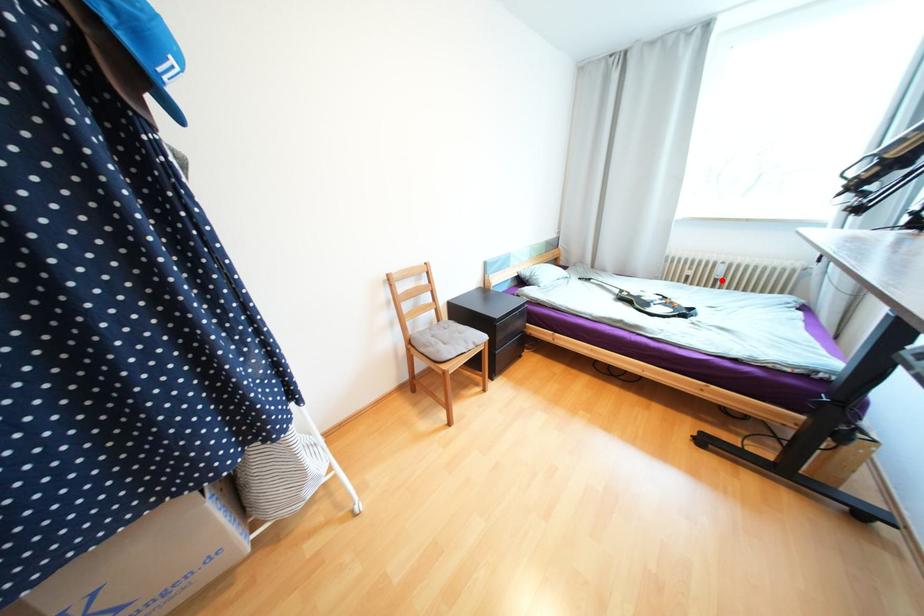
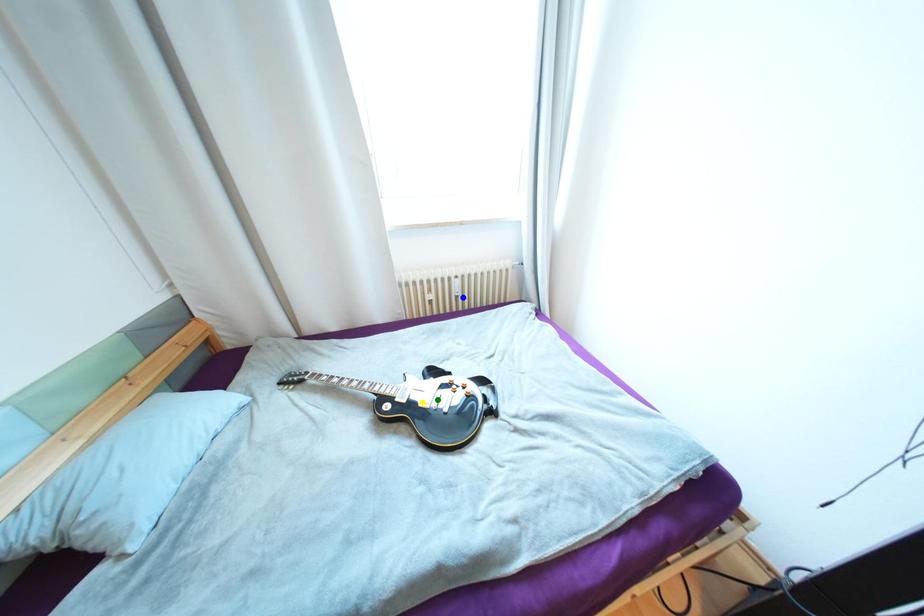
Question: I am providing you with two images of the same scene from different viewpoints. A red point is marked on the first image. You are given multiple points on the second image. Which point in image 2 represents the same 3d spot as the red point in image 1?

Choices:
 (A) yellow point
 (B) blue point
 (C) green point

Answer: (B)